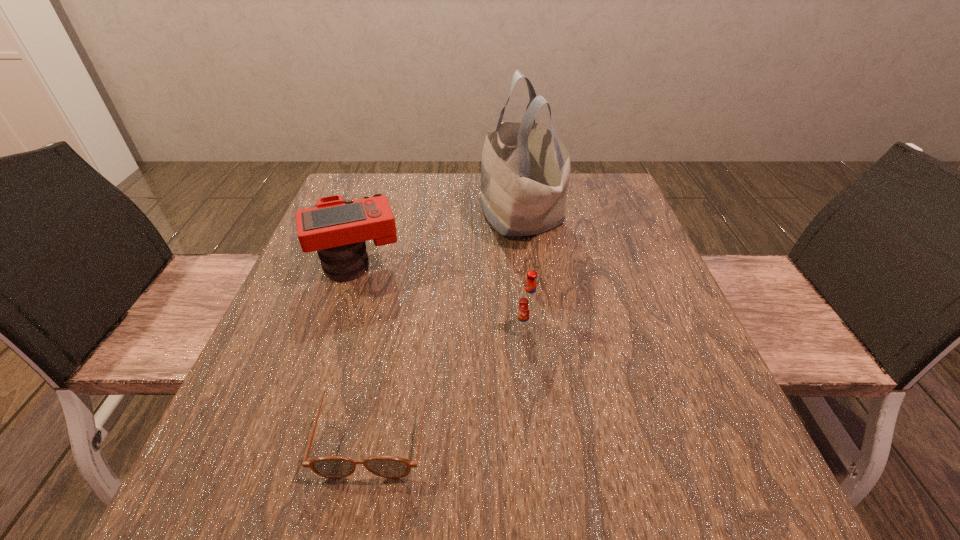
This screenshot has width=960, height=540. In order to click on free space between the root beer and the sunglasses in this screenshot , I will do `click(450, 377)`.

Identify the location of vacant space that is in between the camera and the nearest object. This screenshot has height=540, width=960. (366, 347).

Identify the location of free space between the shopping bag and the camera. (439, 240).

Identify the location of free space between the camera and the shopping bag. The width and height of the screenshot is (960, 540). (439, 240).

At what (x,y) coordinates should I click in order to perform the action: click on free spot between the tallest object and the camera. Please return your answer as a coordinate pair (x, y). Looking at the image, I should click on (439, 240).

What are the coordinates of `unoccupied area between the sunglasses and the camera` in the screenshot? It's located at (366, 347).

Locate an element on the screen. This screenshot has width=960, height=540. unoccupied area between the nearest object and the camera is located at coordinates (366, 347).

Locate an element on the screen. vacant space that's between the camera and the shopping bag is located at coordinates (439, 240).

Locate an element on the screen. empty location between the root beer and the nearest object is located at coordinates (450, 377).

This screenshot has height=540, width=960. Identify the location of free space between the second nearest object and the shortest object. (450, 377).